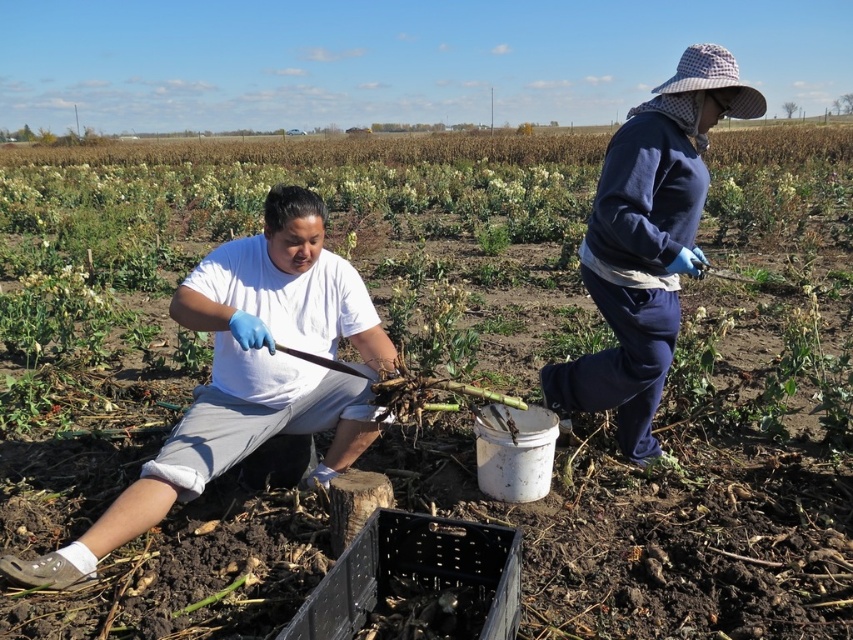
Between white cotton shirt at center and navy fleece jacket at upper right, which one has less height?

Standing shorter between the two is white cotton shirt at center.

Does white cotton shirt at center appear under navy fleece jacket at upper right?

Yes.

You are a GUI agent. You are given a task and a screenshot of the screen. Output one action in this format:
    pyautogui.click(x=<x>, y=<y>)
    Task: Click on the white cotton shirt at center
    The width and height of the screenshot is (853, 640).
    Given the screenshot: What is the action you would take?
    pyautogui.click(x=248, y=376)